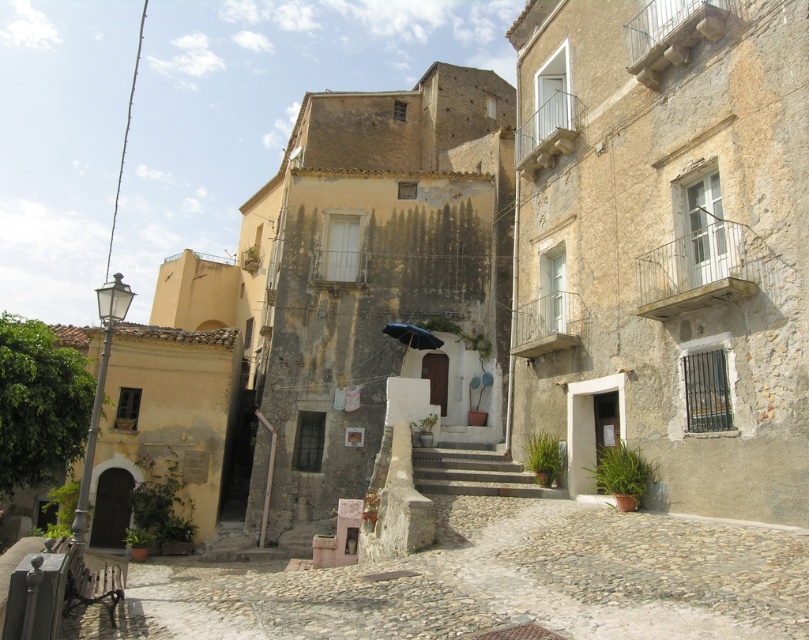
Can you confirm if smooth stone stairs at center is positioned to the left of black matte umbrella at center?

No, smooth stone stairs at center is not to the left of black matte umbrella at center.

Which of these two, smooth stone stairs at center or black matte umbrella at center, stands taller?

With more height is smooth stone stairs at center.

This screenshot has height=640, width=809. In order to click on smooth stone stairs at center in this screenshot , I will do `click(473, 472)`.